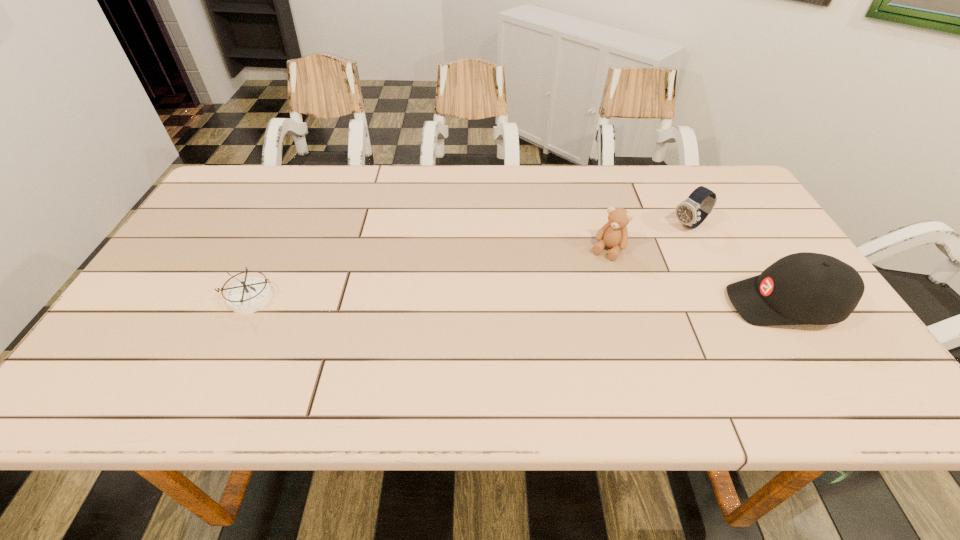
Find the location of a particular element. the shortest object is located at coordinates (249, 295).

The height and width of the screenshot is (540, 960). What are the coordinates of `the leftmost object` in the screenshot? It's located at (249, 295).

The width and height of the screenshot is (960, 540). Identify the location of baseball cap. (803, 288).

You are a GUI agent. You are given a task and a screenshot of the screen. Output one action in this format:
    pyautogui.click(x=<x>, y=<y>)
    Task: Click on the farthest object
    This screenshot has height=540, width=960.
    Given the screenshot: What is the action you would take?
    (691, 212)

Locate an element on the screen. This screenshot has height=540, width=960. the third object from right to left is located at coordinates (614, 234).

This screenshot has width=960, height=540. Identify the location of the second farthest object. (614, 234).

Find the location of `vacant space located 0.160m on the back of the leftmost object`. vacant space located 0.160m on the back of the leftmost object is located at coordinates (278, 239).

You are a GUI agent. You are given a task and a screenshot of the screen. Output one action in this format:
    pyautogui.click(x=<x>, y=<y>)
    Task: Click on the vacant region located 0.100m with a logo on the front of the baseball cap
    The image size is (960, 540).
    Given the screenshot: What is the action you would take?
    pyautogui.click(x=685, y=304)

Find the location of a particular element. Image resolution: width=960 pixels, height=540 pixels. vacant space located 0.320m with a logo on the front of the baseball cap is located at coordinates pyautogui.click(x=593, y=304).

You are a GUI agent. You are given a task and a screenshot of the screen. Output one action in this format:
    pyautogui.click(x=<x>, y=<y>)
    Task: Click on the vacant position located 0.330m with a logo on the front of the baseball cap
    This screenshot has height=540, width=960.
    Given the screenshot: What is the action you would take?
    pyautogui.click(x=589, y=304)